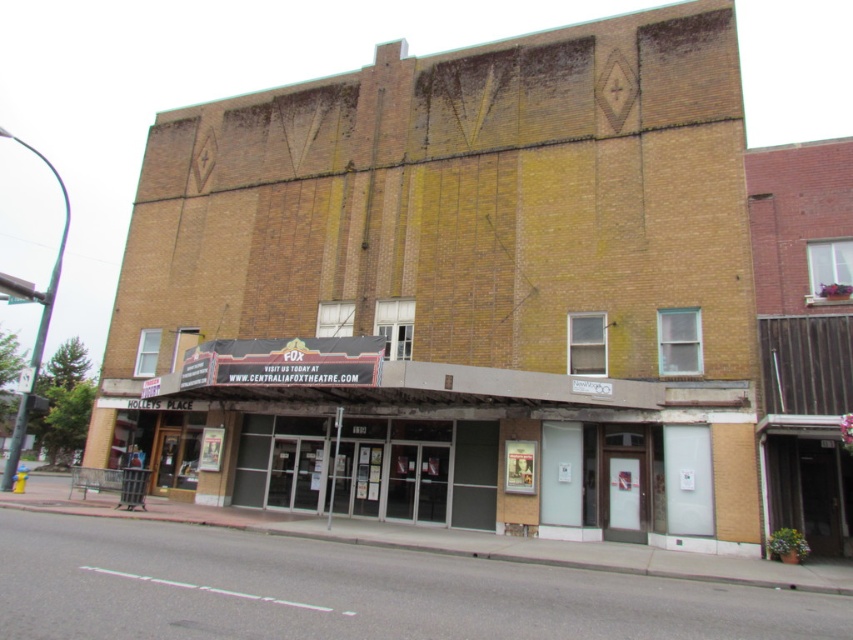
Question: From the image, what is the correct spatial relationship of brown brick theater at center in relation to brick theater at center?

Choices:
 (A) below
 (B) above

Answer: (B)

Question: Which object appears closest to the camera in this image?

Choices:
 (A) brick theater at center
 (B) brown brick theater at center

Answer: (A)

Question: Can you confirm if brown brick theater at center is positioned below brick theater at center?

Choices:
 (A) yes
 (B) no

Answer: (B)

Question: Is brown brick theater at center in front of brick theater at center?

Choices:
 (A) no
 (B) yes

Answer: (A)

Question: Which point is farther from the camera taking this photo?

Choices:
 (A) pos(595,429)
 (B) pos(126,300)

Answer: (B)